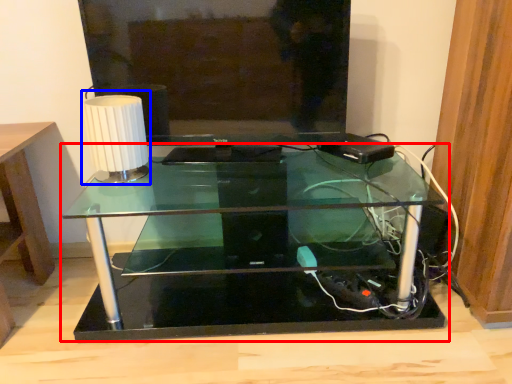
Question: Which object appears farthest to the camera in this image, table (highlighted by a red box) or table lamp (highlighted by a blue box)?

Choices:
 (A) table
 (B) table lamp

Answer: (B)